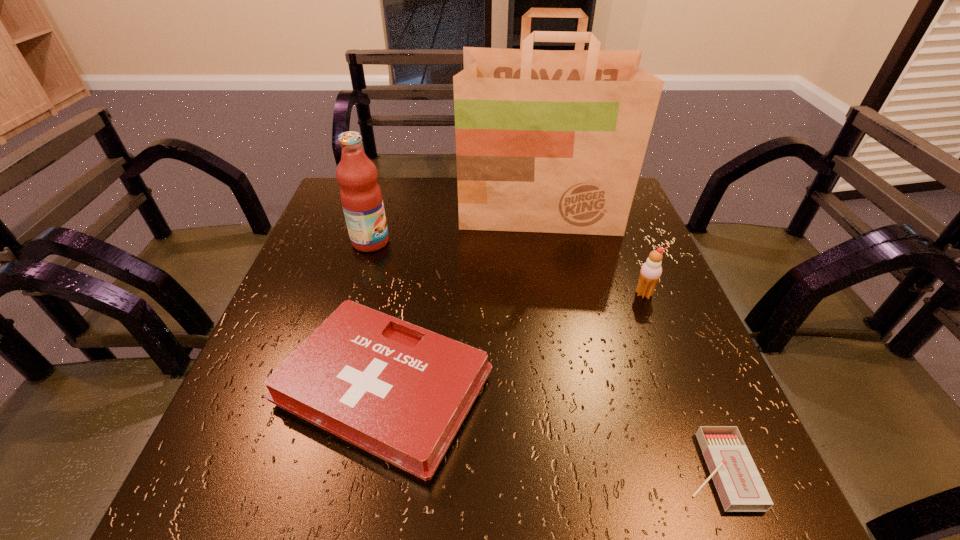
The image size is (960, 540). Identify the location of vacant space that satisfies the following two spatial constraints: 1. on the back side of the first-aid kit; 2. on the right side of the grocery bag. (418, 210).

You are a GUI agent. You are given a task and a screenshot of the screen. Output one action in this format:
    pyautogui.click(x=<x>, y=<y>)
    Task: Click on the free point that satisfies the following two spatial constraints: 1. on the front label of the first-aid kit; 2. on the left side of the second tallest object
    
    Given the screenshot: What is the action you would take?
    pyautogui.click(x=326, y=389)